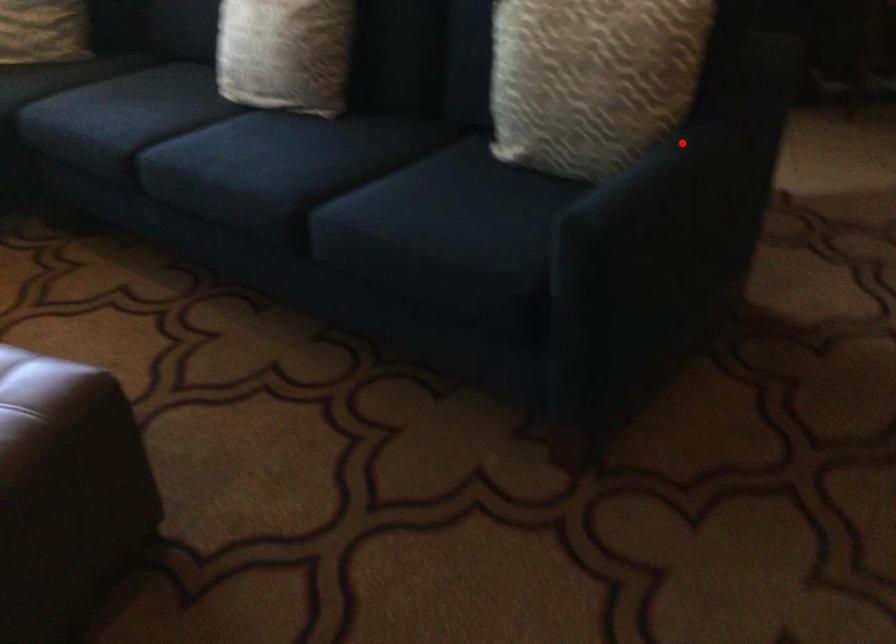
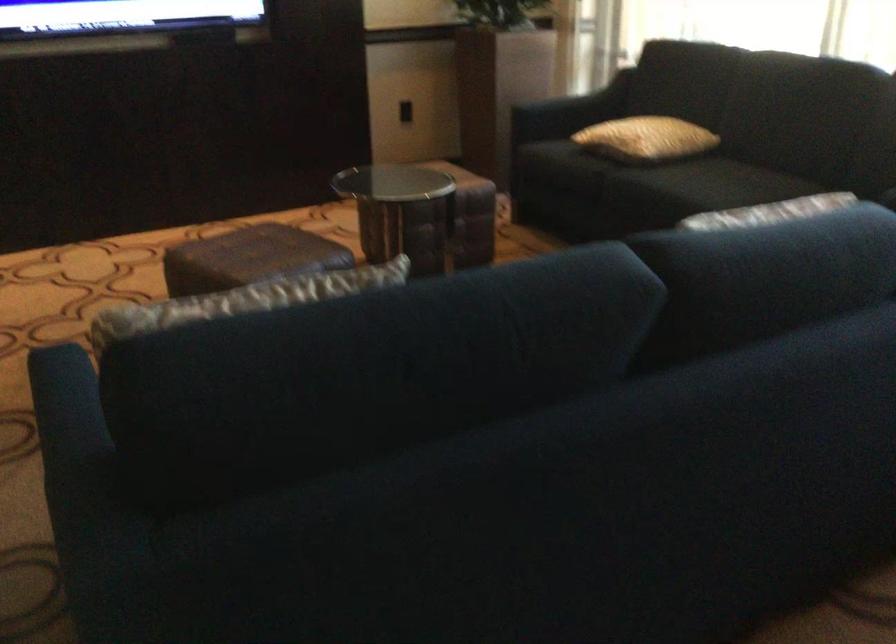
Find the pixel in the second image that matches the highlighted location in the first image.

(69, 431)